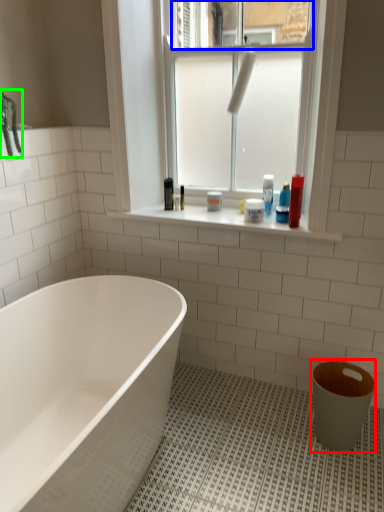
Question: Based on their relative distances, which object is farther from toilet bowl (highlighted by a red box)? Choose from window screen (highlighted by a blue box) and plant (highlighted by a green box).

Choices:
 (A) window screen
 (B) plant

Answer: (B)